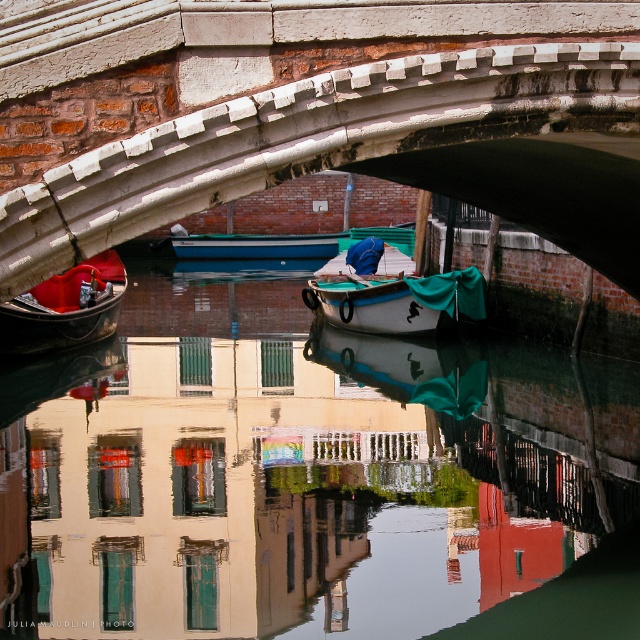
Question: Can you confirm if transparent water at center is wider than white stone arch bridge at center?

Choices:
 (A) no
 (B) yes

Answer: (B)

Question: Which point is closer to the camera?

Choices:
 (A) blue glossy boat at center
 (B) white matte boat at center
 (C) matte black gondola at left

Answer: (C)

Question: Which point is closer to the camera taking this photo?

Choices:
 (A) (92, 284)
 (B) (449, 608)

Answer: (B)

Question: Does transparent water at center have a larger size compared to white stone arch bridge at center?

Choices:
 (A) yes
 (B) no

Answer: (A)

Question: Considering the relative positions of transparent water at center and matte black gondola at left in the image provided, where is transparent water at center located with respect to matte black gondola at left?

Choices:
 (A) right
 (B) left

Answer: (A)

Question: Which point is farther to the camera?

Choices:
 (A) white stone arch bridge at center
 (B) white matte boat at center

Answer: (B)